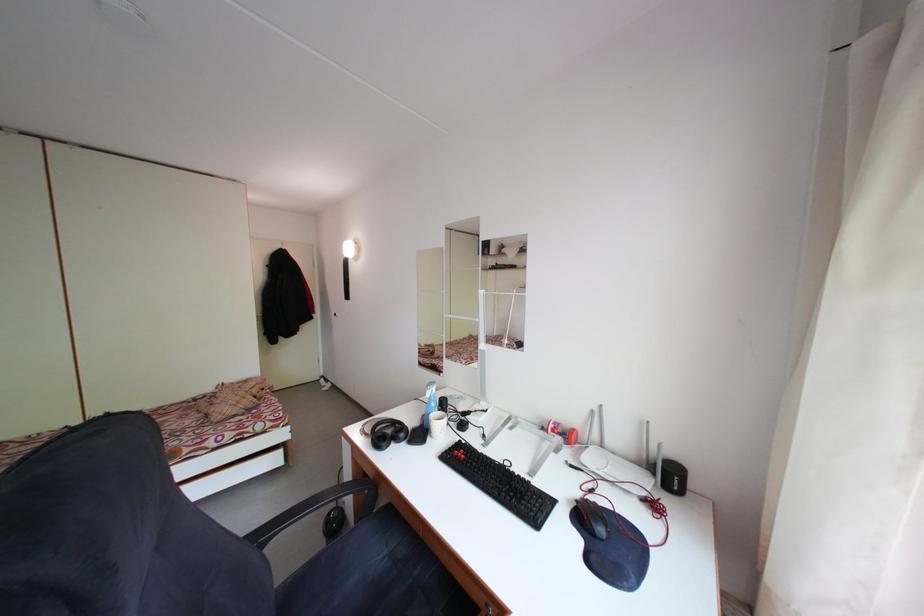
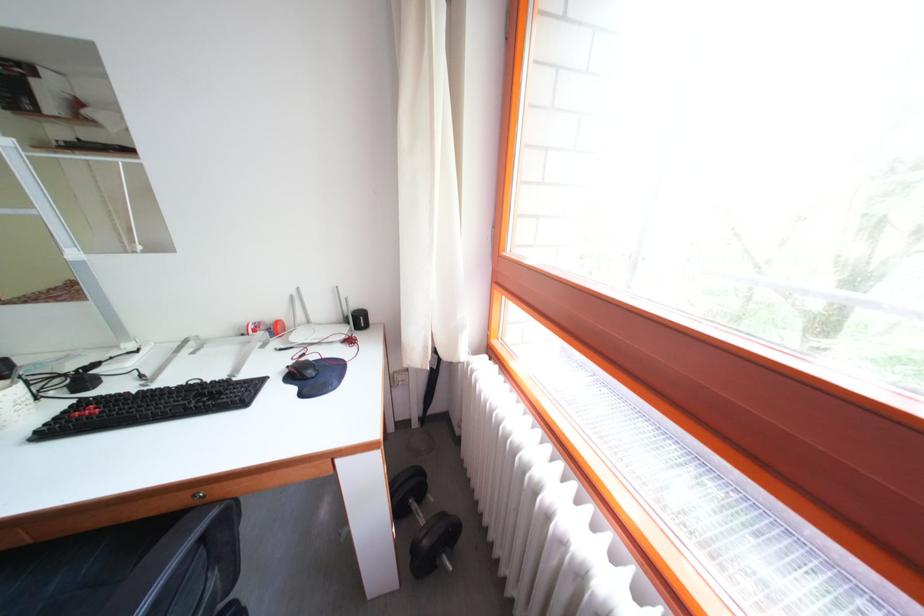
Find the pixel in the second image that matches pixel 601 418 in the first image.

(300, 302)